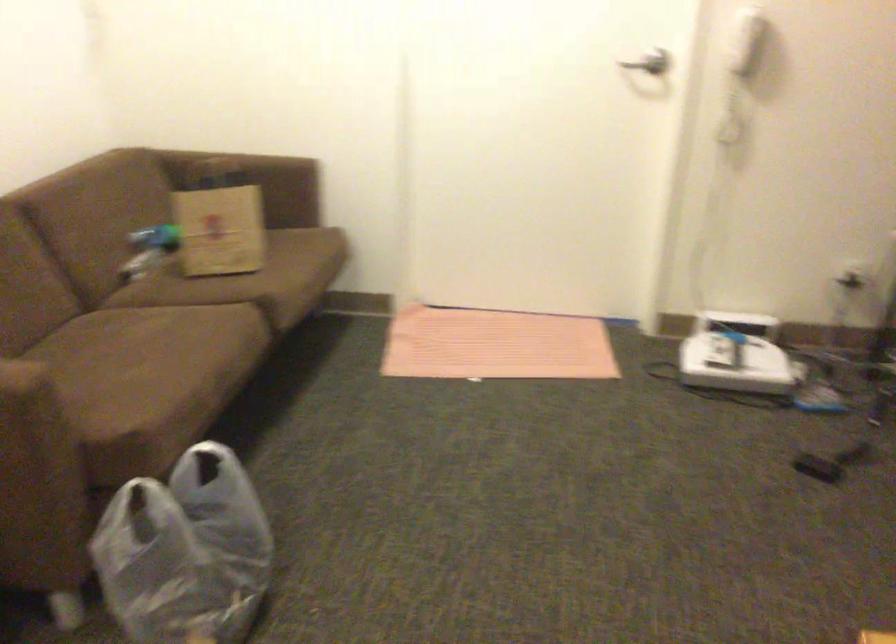
Image resolution: width=896 pixels, height=644 pixels. What are the coordinates of `brown sofa sitting surface` in the screenshot? It's located at [x=110, y=402].